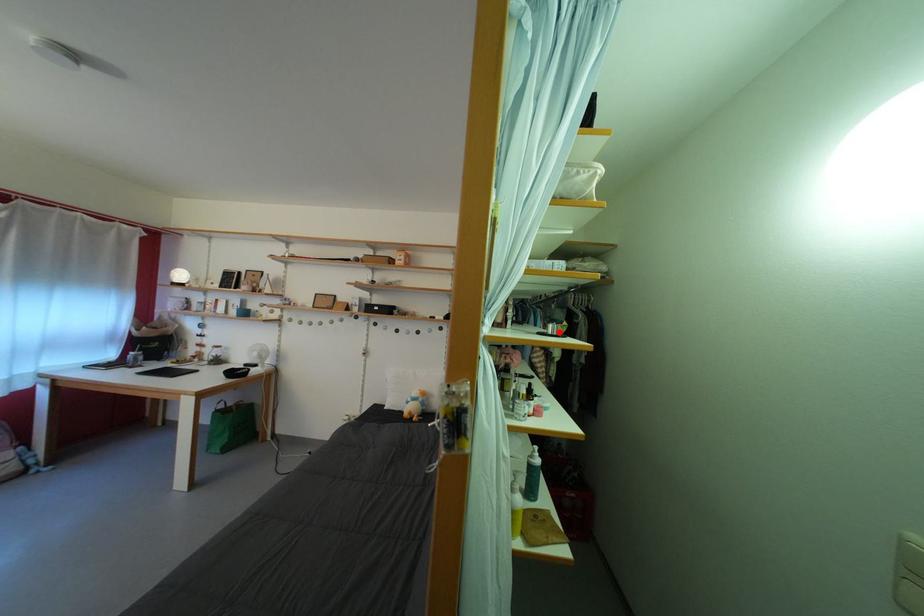
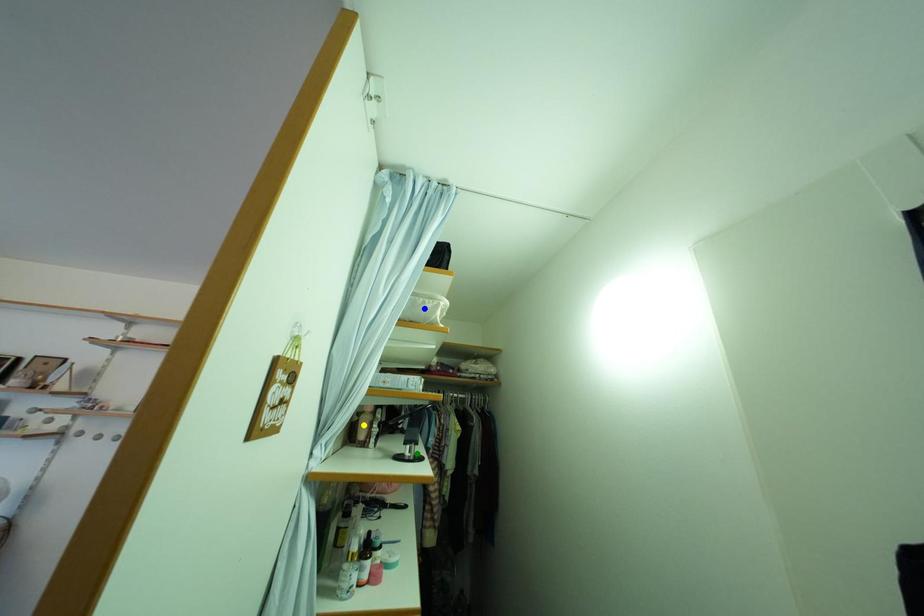
Question: I am providing you with two images of the same scene from different viewpoints. A red point is marked on the first image. You are given multiple points on the second image. Which point in image 2 is actually the same real-world point as the red point in image 1?

Choices:
 (A) green point
 (B) blue point
 (C) yellow point

Answer: (A)